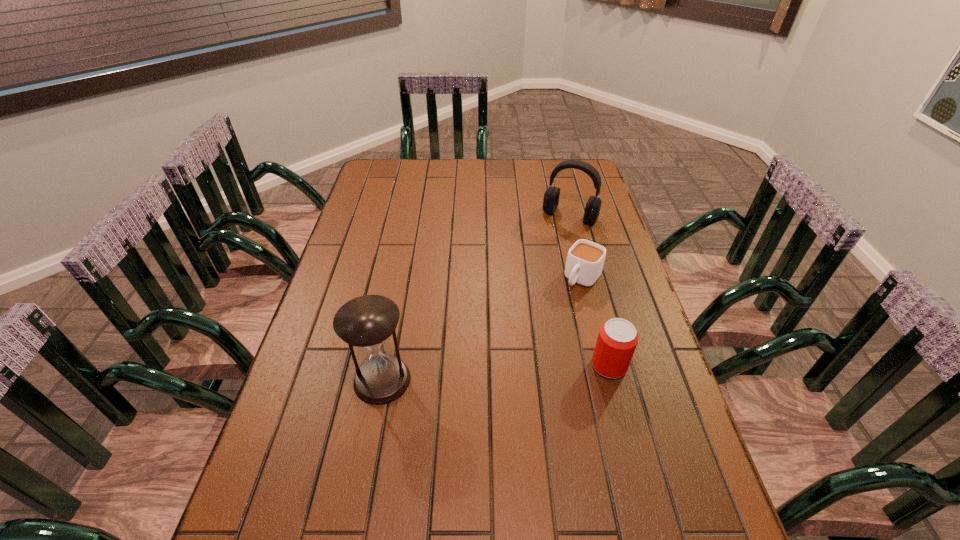
This screenshot has width=960, height=540. In order to click on free location at the right edge in this screenshot , I will do `click(565, 208)`.

This screenshot has height=540, width=960. In the image, there is a desktop. What are the coordinates of `free space at the far left corner` in the screenshot? It's located at (397, 161).

In the image, there is a desktop. At what (x,y) coordinates should I click in order to perform the action: click on vacant space at the far right corner. Please return your answer as a coordinate pair (x, y). The height and width of the screenshot is (540, 960). Looking at the image, I should click on (563, 160).

Where is `blank region between the leftmost object and the beer can`? This screenshot has height=540, width=960. blank region between the leftmost object and the beer can is located at coordinates (495, 373).

Locate an element on the screen. This screenshot has height=540, width=960. blank region between the second farthest object and the second shortest object is located at coordinates (596, 322).

Locate an element on the screen. This screenshot has width=960, height=540. free point between the hourglass and the third tallest object is located at coordinates (495, 373).

The image size is (960, 540). Identify the location of vacant space that's between the farthest object and the third tallest object. (589, 291).

The width and height of the screenshot is (960, 540). Identify the location of free space between the hourglass and the headset. (476, 298).

Where is `free spot between the cup and the hourglass`? free spot between the cup and the hourglass is located at coordinates (x=483, y=329).

Locate an element on the screen. Image resolution: width=960 pixels, height=540 pixels. free spot between the headset and the third tallest object is located at coordinates (589, 291).